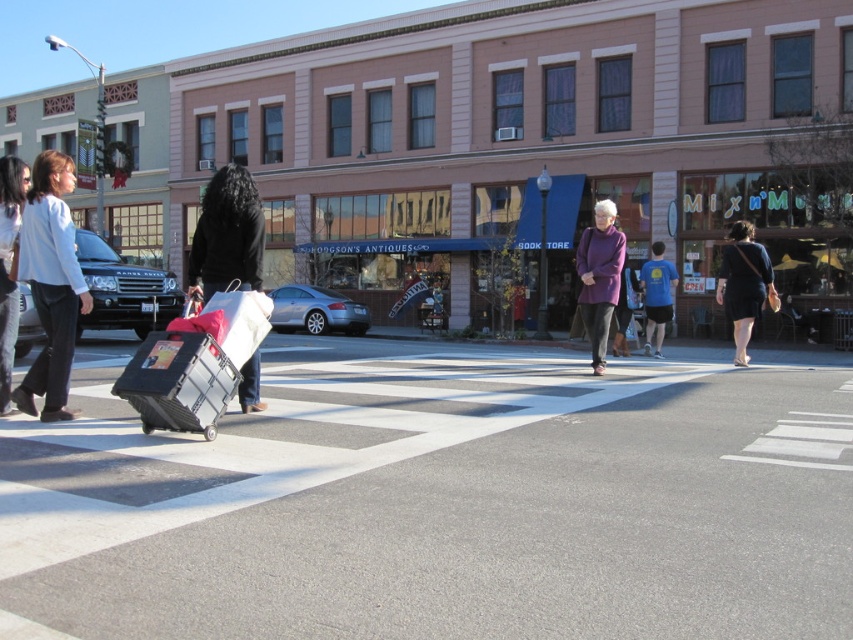
Question: Can you confirm if light blue cotton shirt at left is bigger than dark blue dress at center?

Choices:
 (A) yes
 (B) no

Answer: (A)

Question: Estimate the real-world distances between objects in this image. Which object is closer to the blue cotton shirt at center?

Choices:
 (A) purple woolen sweater at center
 (B) black plastic cart at center
 (C) black fabric bag at center

Answer: (A)

Question: Which point is closer to the camera?

Choices:
 (A) blue cotton shirt at center
 (B) metallic silver cart at lower left
 (C) light blue cotton shirt at left
 (D) dark blue dress at center

Answer: (B)

Question: Is metallic silver cart at lower left positioned at the back of purple woolen sweater at center?

Choices:
 (A) yes
 (B) no

Answer: (B)

Question: Which point is farther from the camera taking this photo?

Choices:
 (A) pos(660,262)
 (B) pos(611,257)
 (C) pos(165,342)

Answer: (A)

Question: From the image, what is the correct spatial relationship of black plastic cart at center in relation to black fabric bag at center?

Choices:
 (A) right
 (B) left

Answer: (A)